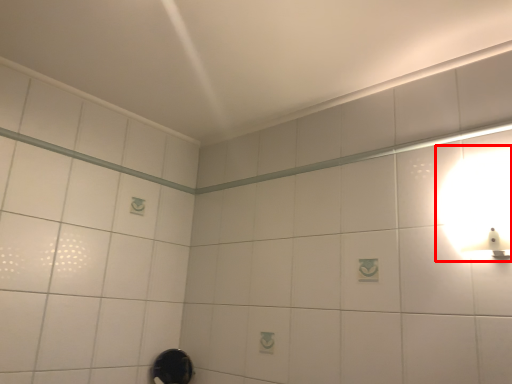
Question: From the image's perspective, where is light fixture (annotated by the red box) located relative to shower?

Choices:
 (A) above
 (B) below

Answer: (A)